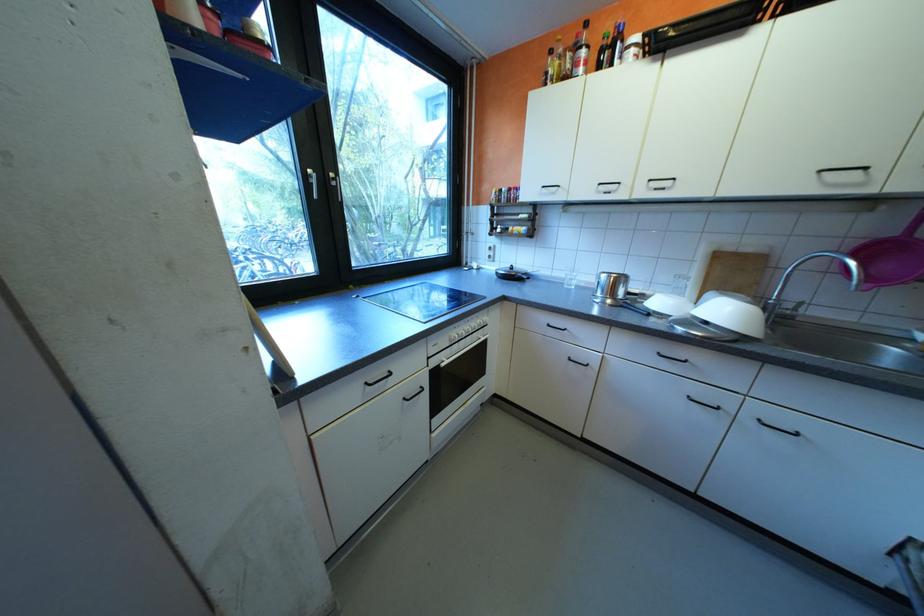
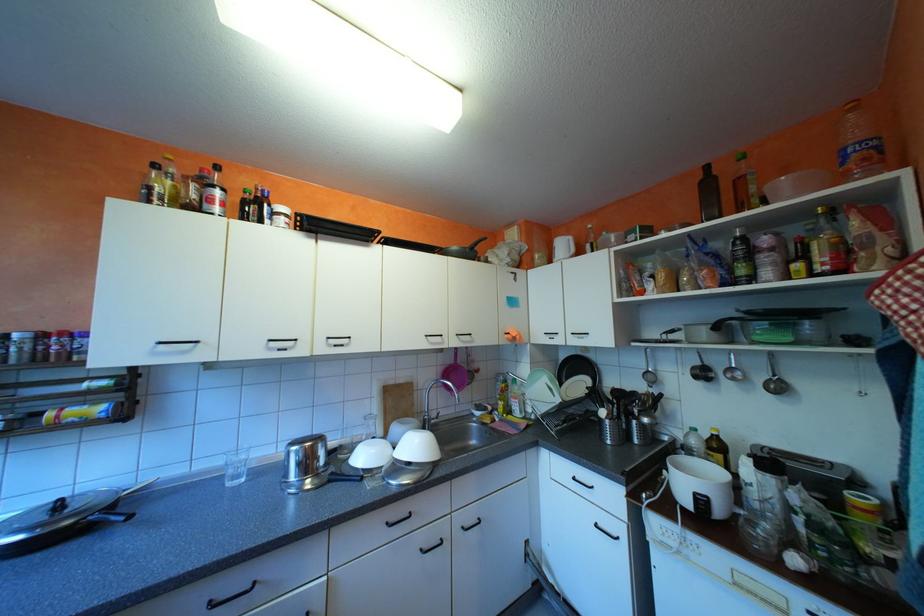
Where in the second image is the point corresponding to (x=578, y=285) from the first image?

(239, 483)